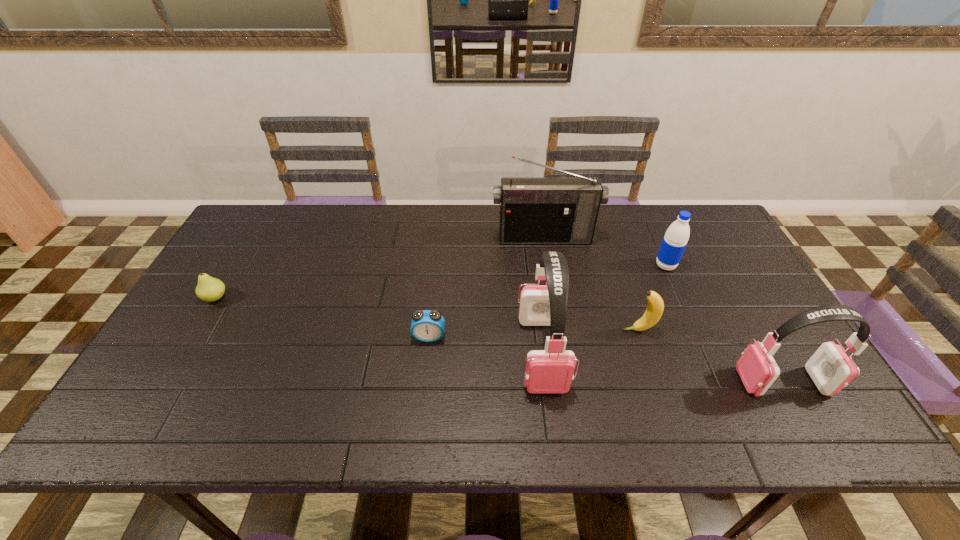
Locate an element on the screen. object that is at the far edge is located at coordinates (533, 210).

Locate an element on the screen. Image resolution: width=960 pixels, height=540 pixels. object positioned at the left edge is located at coordinates (209, 289).

Locate an element on the screen. object located in the right edge section of the desktop is located at coordinates (830, 368).

Identify the location of object at the near right corner. Image resolution: width=960 pixels, height=540 pixels. (830, 368).

Find the location of a particular element. The image size is (960, 540). vacant space at the far edge of the desktop is located at coordinates (398, 206).

In the image, there is a desktop. Identify the location of vacant space at the near edge. (465, 370).

Identify the location of free space at the right edge. Image resolution: width=960 pixels, height=540 pixels. (755, 340).

Locate an element on the screen. free space at the far left corner of the desktop is located at coordinates (271, 243).

This screenshot has height=540, width=960. I want to click on empty location between the alarm clock and the left earphone, so click(x=486, y=345).

Identify the location of vacant area between the farthest object and the banana. (591, 284).